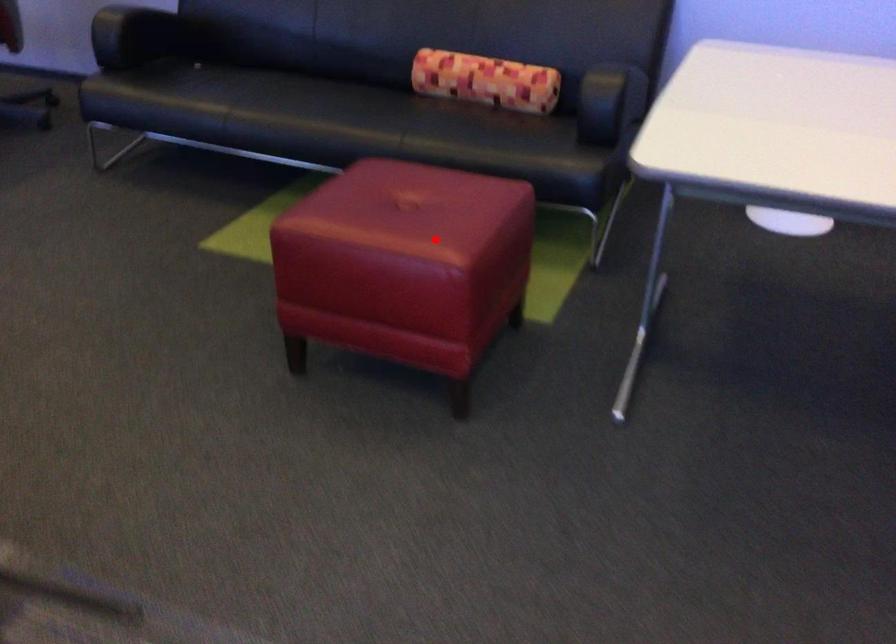
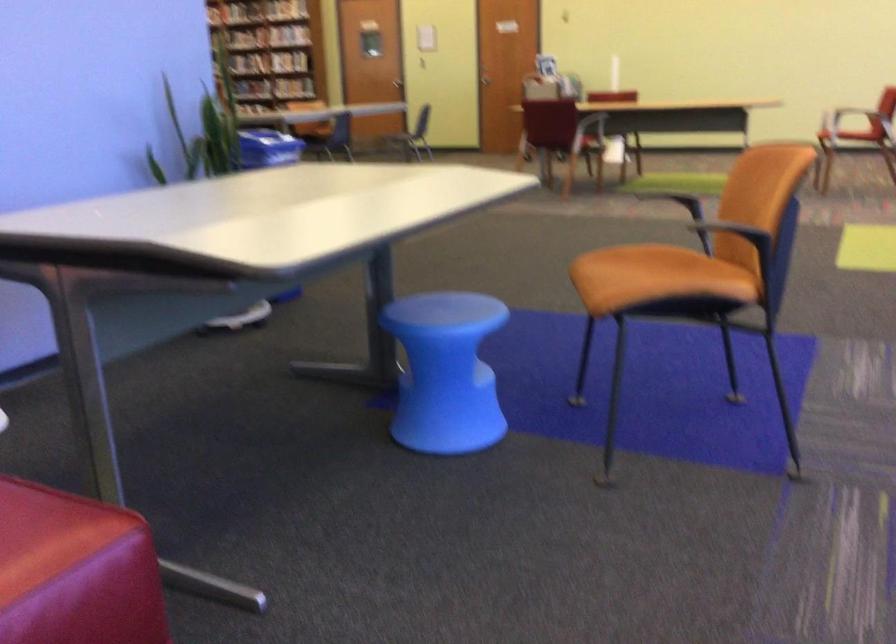
Question: I am providing you with two images of the same scene from different viewpoints. In image1, a red point is highlighted. Considering the same 3D point in image2, which of the following is correct?

Choices:
 (A) It is closer
 (B) It is farther

Answer: (A)